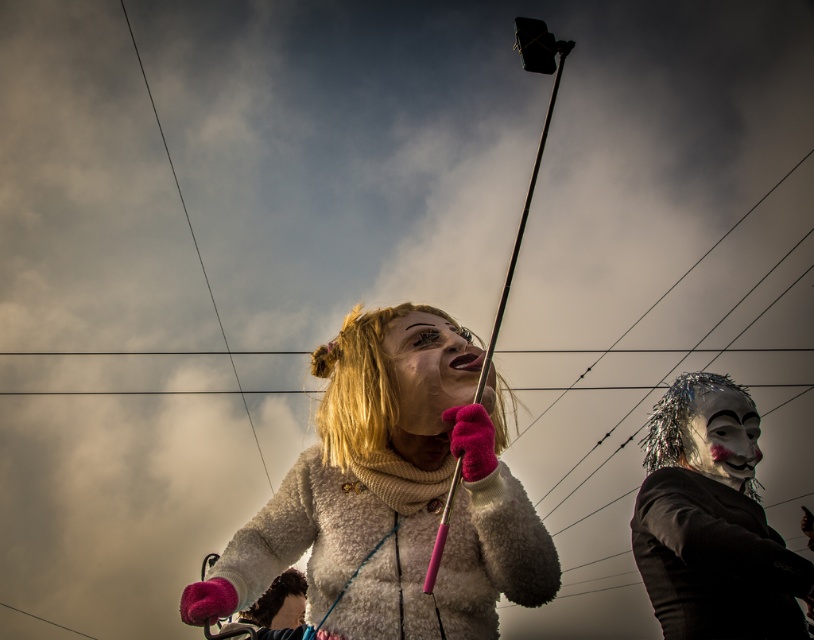
Question: Among these objects, which one is farthest from the camera?

Choices:
 (A) silvery metallic mask at upper right
 (B) shiny silver mask at center

Answer: (A)

Question: Which object appears farthest from the camera in this image?

Choices:
 (A) shiny silver mask at center
 (B) fluffy white coat at center

Answer: (A)

Question: Which of the following is the closest to the observer?

Choices:
 (A) silvery metallic mask at upper right
 (B) smooth white mask at center

Answer: (B)

Question: Is smooth white mask at center in front of silvery metallic mask at upper right?

Choices:
 (A) no
 (B) yes

Answer: (B)

Question: Is shiny silver mask at center thinner than silvery metallic mask at upper right?

Choices:
 (A) yes
 (B) no

Answer: (B)

Question: Is fluffy white coat at center to the right of shiny silver mask at center from the viewer's perspective?

Choices:
 (A) no
 (B) yes

Answer: (A)